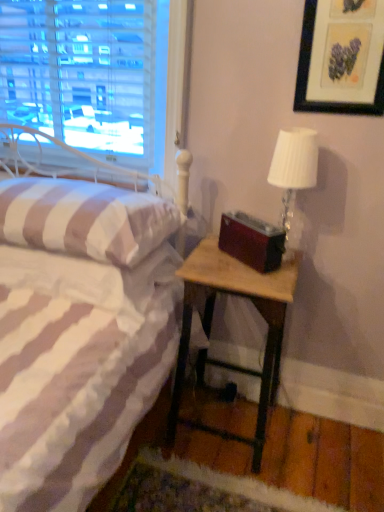
Question: Can white striped fabric pillow at left be found inside matte black picture frame at upper right?

Choices:
 (A) no
 (B) yes

Answer: (A)

Question: Is matte black picture frame at upper right shorter than white striped fabric pillow at left?

Choices:
 (A) yes
 (B) no

Answer: (B)

Question: From a real-world perspective, is matte black picture frame at upper right under white striped fabric pillow at left?

Choices:
 (A) no
 (B) yes

Answer: (A)

Question: Are matte black picture frame at upper right and white striped fabric pillow at left making contact?

Choices:
 (A) yes
 (B) no

Answer: (B)

Question: From the image's perspective, is matte black picture frame at upper right located beneath white striped fabric pillow at left?

Choices:
 (A) no
 (B) yes

Answer: (A)

Question: From a real-world perspective, relative to wooden nightstand at lower right, is matte black picture frame at upper right vertically above or below?

Choices:
 (A) above
 (B) below

Answer: (A)

Question: Is matte black picture frame at upper right taller or shorter than wooden nightstand at lower right?

Choices:
 (A) short
 (B) tall

Answer: (A)

Question: In terms of width, does matte black picture frame at upper right look wider or thinner when compared to wooden nightstand at lower right?

Choices:
 (A) thin
 (B) wide

Answer: (A)

Question: Is point (365, 4) closer or farther from the camera than point (185, 344)?

Choices:
 (A) closer
 (B) farther

Answer: (A)

Question: In the image, is white striped fabric pillow at left positioned in front of or behind white textured lampshade at upper right?

Choices:
 (A) front
 (B) behind

Answer: (A)

Question: Considering the positions of white striped fabric pillow at left and white textured lampshade at upper right in the image, is white striped fabric pillow at left taller or shorter than white textured lampshade at upper right?

Choices:
 (A) short
 (B) tall

Answer: (A)

Question: From the image's perspective, is white striped fabric pillow at left located above or below white textured lampshade at upper right?

Choices:
 (A) above
 (B) below

Answer: (B)

Question: Considering the positions of white striped fabric pillow at left and white textured lampshade at upper right in the image, is white striped fabric pillow at left bigger or smaller than white textured lampshade at upper right?

Choices:
 (A) big
 (B) small

Answer: (A)

Question: From their relative heights in the image, would you say white striped fabric pillow at left is taller or shorter than wooden nightstand at lower right?

Choices:
 (A) short
 (B) tall

Answer: (A)

Question: Does point (72, 224) appear closer or farther from the camera than point (271, 331)?

Choices:
 (A) farther
 (B) closer

Answer: (B)